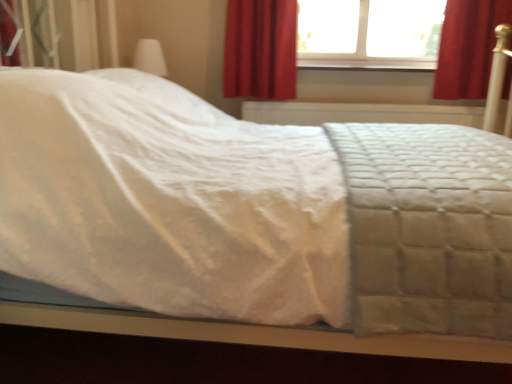
Question: From the image's perspective, is white quilted fabric at center positioned above or below transparent glass window at upper center?

Choices:
 (A) above
 (B) below

Answer: (B)

Question: Does point (179, 286) appear closer or farther from the camera than point (350, 54)?

Choices:
 (A) closer
 (B) farther

Answer: (A)

Question: Which is farther from the smooth wood window sill at upper center?

Choices:
 (A) white quilted fabric at center
 (B) red velvet curtain at upper right, the second curtain when ordered from left to right
 (C) transparent glass window at upper center
 (D) red velvet curtain at upper center, acting as the 2th curtain starting from the right

Answer: (A)

Question: Considering the real-world distances, which object is farthest from the transparent glass window at upper center?

Choices:
 (A) smooth wood window sill at upper center
 (B) red velvet curtain at upper right, the second curtain when ordered from left to right
 (C) red velvet curtain at upper center, acting as the 2th curtain starting from the right
 (D) white quilted fabric at center

Answer: (D)